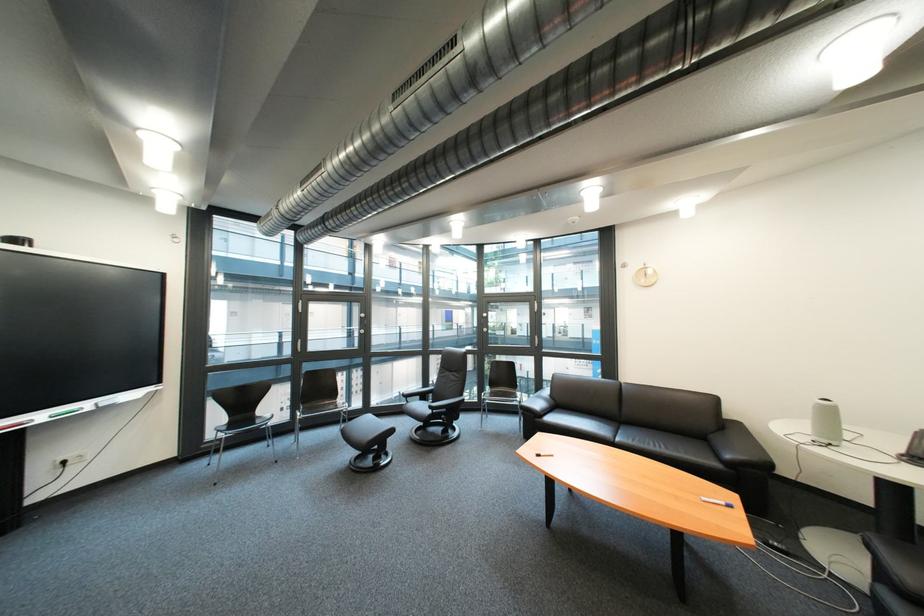
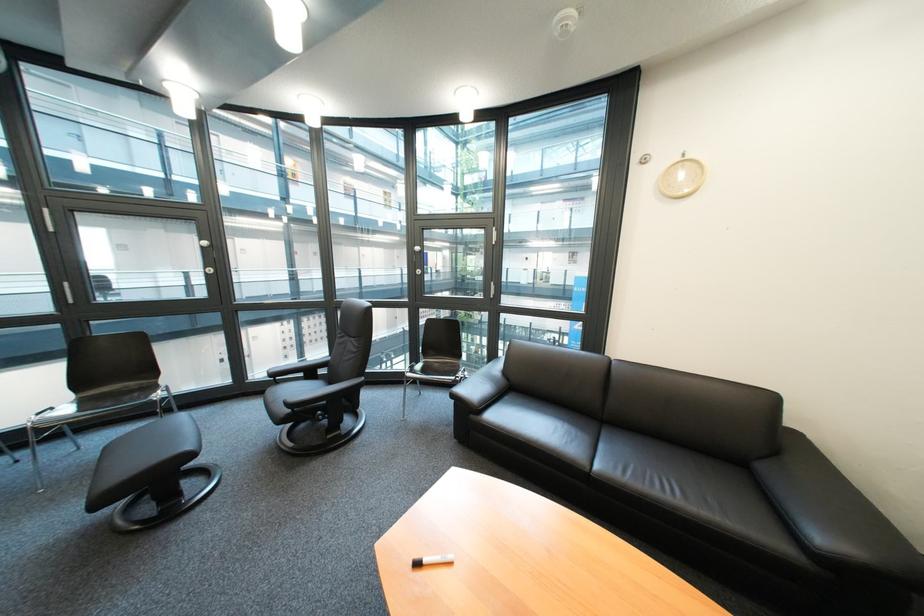
Find the pixel in the second image that matches the point at 551,421 in the first image.

(485, 418)